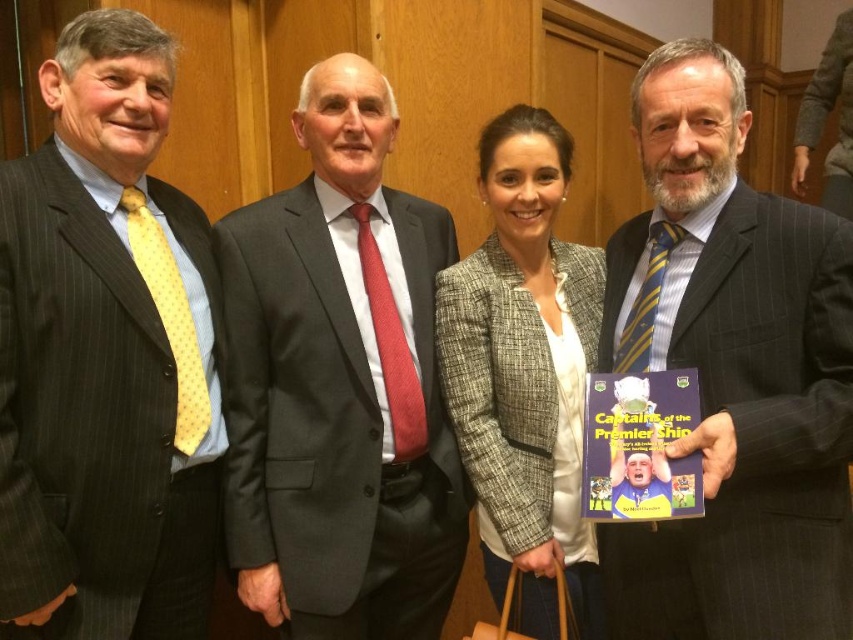
Question: Which of the following is the farthest from the observer?

Choices:
 (A) (737, 134)
 (B) (339, 289)
 (C) (552, 502)

Answer: (C)

Question: Can you confirm if matte black suit at left is positioned below striped wool suit at center?

Choices:
 (A) yes
 (B) no

Answer: (B)

Question: Which of the following is the closest to the observer?

Choices:
 (A) plaid blazer at center
 (B) matte black suit at left
 (C) striped wool suit at center
 (D) dark gray suit at center

Answer: (C)

Question: Is matte black suit at left closer to camera compared to dark gray suit at center?

Choices:
 (A) yes
 (B) no

Answer: (A)

Question: Which object appears closest to the camera in this image?

Choices:
 (A) dark gray suit at center
 (B) plaid blazer at center

Answer: (A)

Question: Does striped wool suit at center appear on the left side of plaid blazer at center?

Choices:
 (A) no
 (B) yes

Answer: (A)